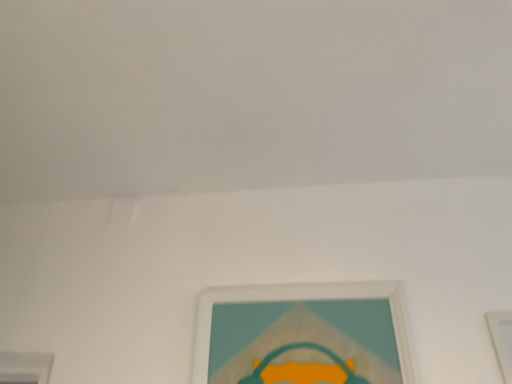
Describe the element at coordinates (303, 335) in the screenshot. I see `white matte picture frame at center, the first picture frame when ordered from left to right` at that location.

Where is `white matte picture frame at center, the first picture frame when ordered from left to right`? white matte picture frame at center, the first picture frame when ordered from left to right is located at coordinates (303, 335).

How much space does white matte picture frame at center, marked as the second picture frame in a right-to-left arrangement, occupy vertically?

white matte picture frame at center, marked as the second picture frame in a right-to-left arrangement, is 11.01 inches in height.

The width and height of the screenshot is (512, 384). Find the location of `white matte picture frame at lower right, the 2th picture frame when ordered from left to right`. white matte picture frame at lower right, the 2th picture frame when ordered from left to right is located at coordinates (502, 339).

What do you see at coordinates (502, 339) in the screenshot? The height and width of the screenshot is (384, 512). I see `white matte picture frame at lower right, arranged as the 1th picture frame when viewed from the right` at bounding box center [502, 339].

In order to click on white matte picture frame at center, marked as the second picture frame in a right-to-left arrangement in this screenshot , I will do `click(303, 335)`.

Based on their positions, is white matte picture frame at center, marked as the second picture frame in a right-to-left arrangement, located to the left or right of white matte picture frame at lower right, the 2th picture frame when ordered from left to right?

white matte picture frame at center, marked as the second picture frame in a right-to-left arrangement, is to the left of white matte picture frame at lower right, the 2th picture frame when ordered from left to right.

Which object is closer to the camera taking this photo, white matte picture frame at center, marked as the second picture frame in a right-to-left arrangement, or white matte picture frame at lower right, the 2th picture frame when ordered from left to right?

white matte picture frame at lower right, the 2th picture frame when ordered from left to right, is more forward.

Between point (276, 367) and point (504, 347), which one is positioned in front?

The point (504, 347) is closer to the camera.

From the image's perspective, would you say white matte picture frame at center, marked as the second picture frame in a right-to-left arrangement, is shown under white matte picture frame at lower right, arranged as the 1th picture frame when viewed from the right?

Incorrect, from the image's perspective, white matte picture frame at center, marked as the second picture frame in a right-to-left arrangement, is higher than white matte picture frame at lower right, arranged as the 1th picture frame when viewed from the right.

From a real-world perspective, which object stands above the other?

From a 3D spatial view, white matte picture frame at center, the first picture frame when ordered from left to right, is above.

Does white matte picture frame at center, marked as the second picture frame in a right-to-left arrangement, have a lesser width compared to white matte picture frame at lower right, the 2th picture frame when ordered from left to right?

In fact, white matte picture frame at center, marked as the second picture frame in a right-to-left arrangement, might be wider than white matte picture frame at lower right, the 2th picture frame when ordered from left to right.

From their relative heights in the image, would you say white matte picture frame at center, the first picture frame when ordered from left to right, is taller or shorter than white matte picture frame at lower right, the 2th picture frame when ordered from left to right?

white matte picture frame at center, the first picture frame when ordered from left to right, is shorter than white matte picture frame at lower right, the 2th picture frame when ordered from left to right.

Who is smaller, white matte picture frame at center, marked as the second picture frame in a right-to-left arrangement, or white matte picture frame at lower right, the 2th picture frame when ordered from left to right?

white matte picture frame at lower right, the 2th picture frame when ordered from left to right.

In the scene shown: Can we say white matte picture frame at center, the first picture frame when ordered from left to right, lies outside white matte picture frame at lower right, arranged as the 1th picture frame when viewed from the right?

That's correct, white matte picture frame at center, the first picture frame when ordered from left to right, is outside of white matte picture frame at lower right, arranged as the 1th picture frame when viewed from the right.

Is white matte picture frame at center, the first picture frame when ordered from left to right, directly adjacent to white matte picture frame at lower right, the 2th picture frame when ordered from left to right?

No, white matte picture frame at center, the first picture frame when ordered from left to right, is not touching white matte picture frame at lower right, the 2th picture frame when ordered from left to right.

Could you tell me if white matte picture frame at center, the first picture frame when ordered from left to right, is facing white matte picture frame at lower right, arranged as the 1th picture frame when viewed from the right?

No, white matte picture frame at center, the first picture frame when ordered from left to right, does not turn towards white matte picture frame at lower right, arranged as the 1th picture frame when viewed from the right.

How many degrees apart are the facing directions of white matte picture frame at center, marked as the second picture frame in a right-to-left arrangement, and white matte picture frame at lower right, the 2th picture frame when ordered from left to right?

0.00249 degrees.

Where is `picture frame located above the white matte picture frame at lower right, the 2th picture frame when ordered from left to right (from the image's perspective)`? The image size is (512, 384). picture frame located above the white matte picture frame at lower right, the 2th picture frame when ordered from left to right (from the image's perspective) is located at coordinates (303, 335).

Does white matte picture frame at lower right, arranged as the 1th picture frame when viewed from the right, appear on the right side of white matte picture frame at center, the first picture frame when ordered from left to right?

Indeed, white matte picture frame at lower right, arranged as the 1th picture frame when viewed from the right, is positioned on the right side of white matte picture frame at center, the first picture frame when ordered from left to right.

Which is in front, white matte picture frame at lower right, arranged as the 1th picture frame when viewed from the right, or white matte picture frame at center, the first picture frame when ordered from left to right?

white matte picture frame at lower right, arranged as the 1th picture frame when viewed from the right, is in front.

Does point (492, 328) come closer to viewer compared to point (341, 302)?

Yes, it is.

From the image's perspective, between white matte picture frame at lower right, arranged as the 1th picture frame when viewed from the right, and white matte picture frame at center, the first picture frame when ordered from left to right, which one is located above?

white matte picture frame at center, the first picture frame when ordered from left to right, appears higher in the image.

From a real-world perspective, is white matte picture frame at lower right, arranged as the 1th picture frame when viewed from the right, positioned above or below white matte picture frame at center, the first picture frame when ordered from left to right?

From a real-world perspective, white matte picture frame at lower right, arranged as the 1th picture frame when viewed from the right, is physically below white matte picture frame at center, the first picture frame when ordered from left to right.

In terms of width, does white matte picture frame at lower right, arranged as the 1th picture frame when viewed from the right, look wider or thinner when compared to white matte picture frame at center, marked as the second picture frame in a right-to-left arrangement?

In the image, white matte picture frame at lower right, arranged as the 1th picture frame when viewed from the right, appears to be more narrow than white matte picture frame at center, marked as the second picture frame in a right-to-left arrangement.

Does white matte picture frame at lower right, the 2th picture frame when ordered from left to right, have a greater height compared to white matte picture frame at center, marked as the second picture frame in a right-to-left arrangement?

Yes, white matte picture frame at lower right, the 2th picture frame when ordered from left to right, is taller than white matte picture frame at center, marked as the second picture frame in a right-to-left arrangement.

Who is smaller, white matte picture frame at lower right, arranged as the 1th picture frame when viewed from the right, or white matte picture frame at center, marked as the second picture frame in a right-to-left arrangement?

Smaller between the two is white matte picture frame at lower right, arranged as the 1th picture frame when viewed from the right.

Is white matte picture frame at lower right, the 2th picture frame when ordered from left to right, not inside white matte picture frame at center, marked as the second picture frame in a right-to-left arrangement?

Yes.

Are white matte picture frame at lower right, arranged as the 1th picture frame when viewed from the right, and white matte picture frame at center, marked as the second picture frame in a right-to-left arrangement, far apart?

No.

Does white matte picture frame at lower right, the 2th picture frame when ordered from left to right, turn towards white matte picture frame at center, marked as the second picture frame in a right-to-left arrangement?

No, white matte picture frame at lower right, the 2th picture frame when ordered from left to right, is not oriented towards white matte picture frame at center, marked as the second picture frame in a right-to-left arrangement.

How different are the orientations of white matte picture frame at lower right, arranged as the 1th picture frame when viewed from the right, and white matte picture frame at center, marked as the second picture frame in a right-to-left arrangement, in degrees?

0.00249 degrees.

There is a white matte picture frame at lower right, arranged as the 1th picture frame when viewed from the right. In order to click on picture frame above it (from a real-world perspective) in this screenshot , I will do `click(303, 335)`.

Locate an element on the screen. Image resolution: width=512 pixels, height=384 pixels. picture frame that appears in front of the white matte picture frame at center, marked as the second picture frame in a right-to-left arrangement is located at coordinates (502, 339).

The height and width of the screenshot is (384, 512). What are the coordinates of `picture frame that appears above the white matte picture frame at lower right, arranged as the 1th picture frame when viewed from the right (from a real-world perspective)` in the screenshot? It's located at (303, 335).